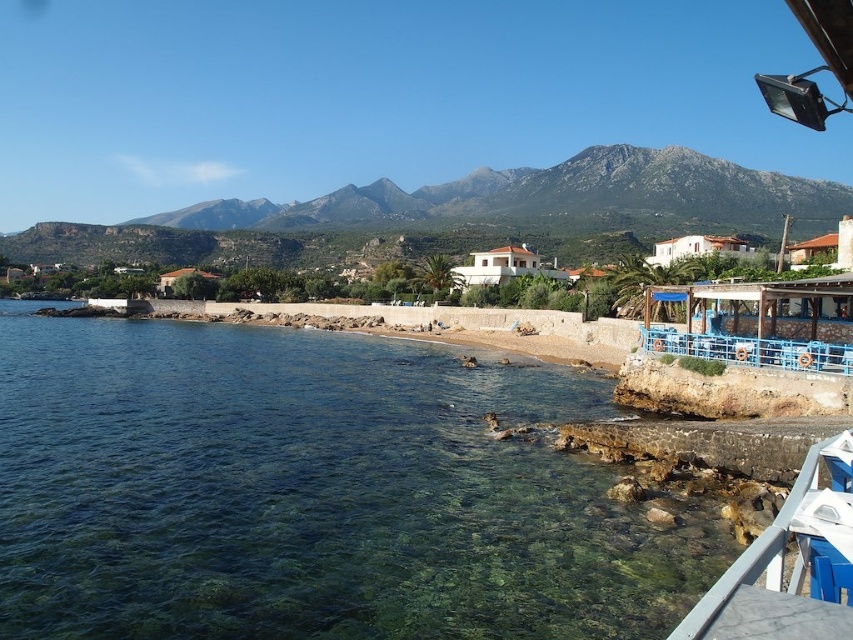
You are standing on the beach and want to walk to the white painted wood dock at lower right without getting your feet wet. Can you do this by staying on the land near the clear water at lower left?

The clear water at lower left is further to the viewer than the white painted wood dock at lower right, so the dock is farther away from you. Since the water is between you and the dock, you would need to walk through the water to reach it. Therefore, you cannot stay on dry land near the clear water at lower left to reach the dock without getting wet.

You are standing on the beach and want to cross from the clear water at lower left to the white painted wood dock at lower right. Based on the scene, which direction should you walk to reach the dock?

The white painted wood dock at lower right is located to the right side of the clear water at lower left. To reach it, walk towards the right along the shoreline.